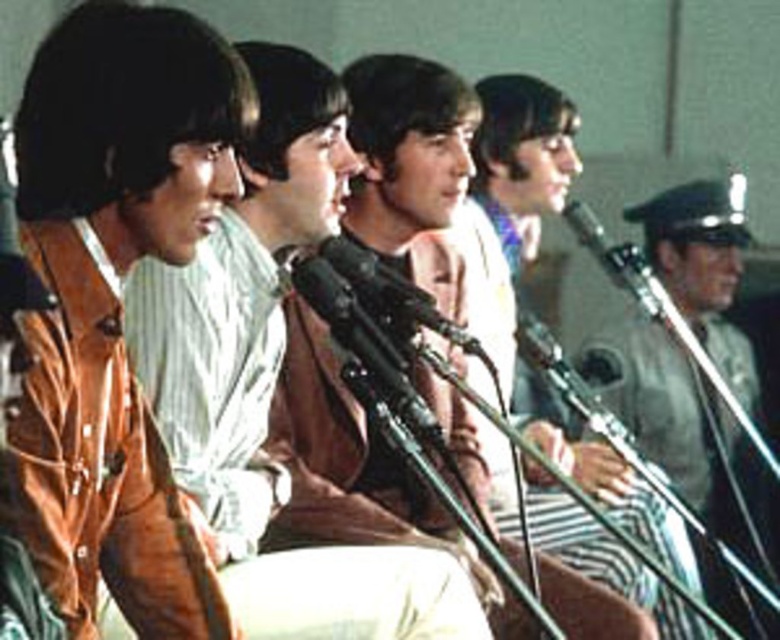
You are a sound technician adjusting microphones for a 1960s band. You notice two microphones in the center area. Which microphone is placed lower between the black metallic microphone at center and the metallic silver microphone at center?

The black metallic microphone at center is positioned under the metallic silver microphone at center, so it is placed lower.

You are a photographer in a studio setting and need to adjust the lighting for the person wearing the gray uniform at right. Based on their position, where should you place the light to best illuminate their face?

The gray uniform at right is located at point (x=679, y=422), so you should position the light slightly to the left of their face to avoid shadows caused by the microphone stand.

You are standing in the studio where the musical act is performing. You need to place a new microphone stand between the two points marked as point (704, 310) and point (369, 282). Which point should the stand be closer to if it needs to be placed behind the front performer?

The microphone stand should be placed closer to point (704, 310) because it is behind point (369, 282), so placing it near the rear point ensures it is positioned behind the front performer.